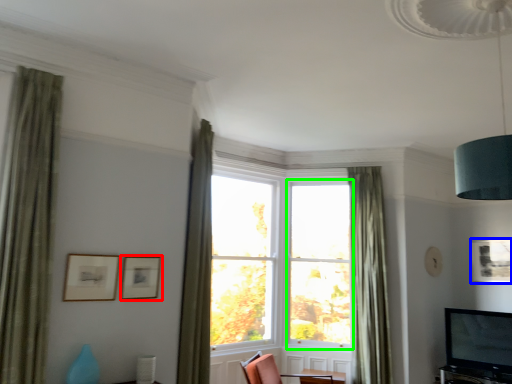
Question: Considering the real-world distances, which object is farthest from picture frame (highlighted by a red box)? picture frame (highlighted by a blue box) or window frame (highlighted by a green box)?

Choices:
 (A) picture frame
 (B) window frame

Answer: (A)